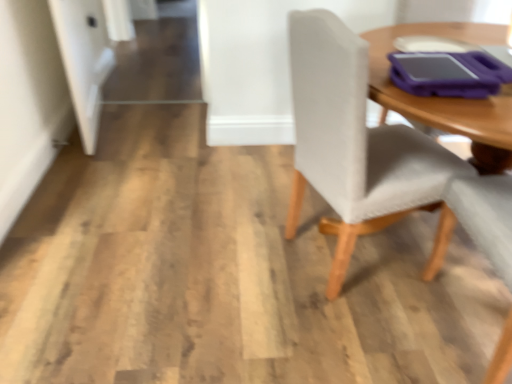
The height and width of the screenshot is (384, 512). In order to click on free region under light gray fabric chair at right (from a real-world perspective) in this screenshot , I will do `click(367, 255)`.